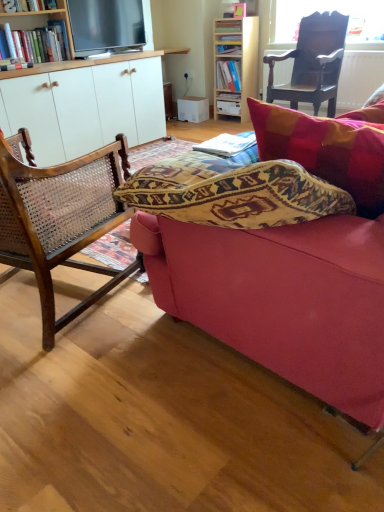
Question: Is wooden cane chair at left, which ranks as the second chair in back-to-front order, far away from light wood bookcase at upper center?

Choices:
 (A) no
 (B) yes

Answer: (B)

Question: Is wooden cane chair at left, positioned as the second chair in right-to-left order, bigger than light wood bookcase at upper center?

Choices:
 (A) no
 (B) yes

Answer: (B)

Question: Does wooden cane chair at left, placed as the 2th chair when sorted from top to bottom, have a lesser height compared to light wood bookcase at upper center?

Choices:
 (A) yes
 (B) no

Answer: (A)

Question: Does wooden cane chair at left, which is counted as the first chair, starting from the left, lie in front of light wood bookcase at upper center?

Choices:
 (A) no
 (B) yes

Answer: (B)

Question: Is wooden cane chair at left, which ranks as the second chair in back-to-front order, thinner than light wood bookcase at upper center?

Choices:
 (A) yes
 (B) no

Answer: (B)

Question: From the image's perspective, is dark wood chair at upper right, placed as the first chair when sorted from back to front, located above or below wooden cane chair at left, arranged as the 1th chair when ordered from the bottom?

Choices:
 (A) below
 (B) above

Answer: (B)

Question: In terms of size, does dark wood chair at upper right, the second chair when ordered from bottom to top, appear bigger or smaller than wooden cane chair at left, positioned as the second chair in right-to-left order?

Choices:
 (A) big
 (B) small

Answer: (B)

Question: From a real-world perspective, is dark wood chair at upper right, which ranks as the 1th chair in top-to-bottom order, physically located above or below wooden cane chair at left, positioned as the second chair in right-to-left order?

Choices:
 (A) above
 (B) below

Answer: (A)

Question: Relative to wooden cane chair at left, which is counted as the first chair, starting from the left, is dark wood chair at upper right, placed as the first chair when sorted from back to front, in front or behind?

Choices:
 (A) behind
 (B) front

Answer: (A)

Question: In terms of height, does hardcover book at center, the second book positioned from the bottom, look taller or shorter compared to matte pink fabric couch at center?

Choices:
 (A) tall
 (B) short

Answer: (B)

Question: Is hardcover book at center, which is the 3th book from top to bottom, situated inside matte pink fabric couch at center or outside?

Choices:
 (A) inside
 (B) outside

Answer: (B)

Question: From the image's perspective, is hardcover book at center, the second book positioned from the bottom, located above or below matte pink fabric couch at center?

Choices:
 (A) above
 (B) below

Answer: (A)

Question: Is point (238, 97) positioned closer to the camera than point (339, 153)?

Choices:
 (A) farther
 (B) closer

Answer: (A)

Question: In the image, is hardcover book at upper center, acting as the 2th book starting from the front, positioned in front of or behind matte blue book at upper center, positioned as the 2th book in top-to-bottom order?

Choices:
 (A) front
 (B) behind

Answer: (A)

Question: In the image, is hardcover book at upper center, which ranks as the third book in back-to-front order, on the left side or the right side of matte blue book at upper center, which is the 3th book from front to back?

Choices:
 (A) right
 (B) left

Answer: (B)